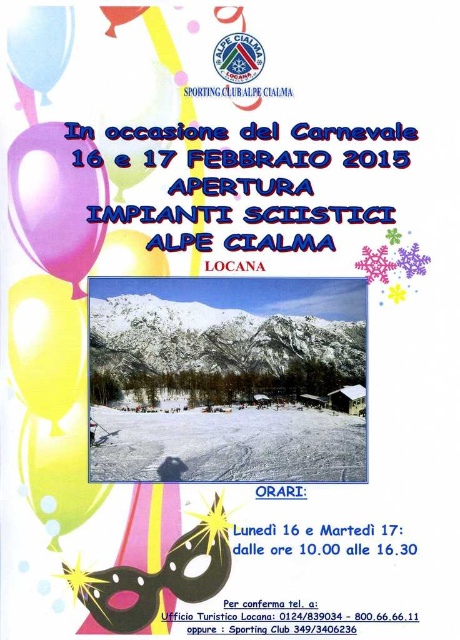
Locate an element on the screen. Image resolution: width=460 pixels, height=640 pixels. pink glossy balloon at upper left is located at coordinates (57, 200).

Is pink glossy balloon at upper left further to the viewer compared to yellow matte balloon at upper left?

No, it is not.

What are the coordinates of `pink glossy balloon at upper left` in the screenshot? It's located at (57, 200).

This screenshot has height=640, width=460. What are the coordinates of `pink glossy balloon at upper left` in the screenshot? It's located at (57, 200).

Between point (51, 218) and point (22, 465), which one is positioned behind?

Point (51, 218)

The height and width of the screenshot is (640, 460). Find the location of `pink glossy balloon at upper left`. pink glossy balloon at upper left is located at coordinates (57, 200).

Who is positioned more to the right, white snow ski slope at center or yellow matte balloon at lower left?

white snow ski slope at center

Based on the photo, does white snow ski slope at center appear under yellow matte balloon at lower left?

Incorrect, white snow ski slope at center is not positioned below yellow matte balloon at lower left.

Locate an element on the screen. white snow ski slope at center is located at coordinates (226, 444).